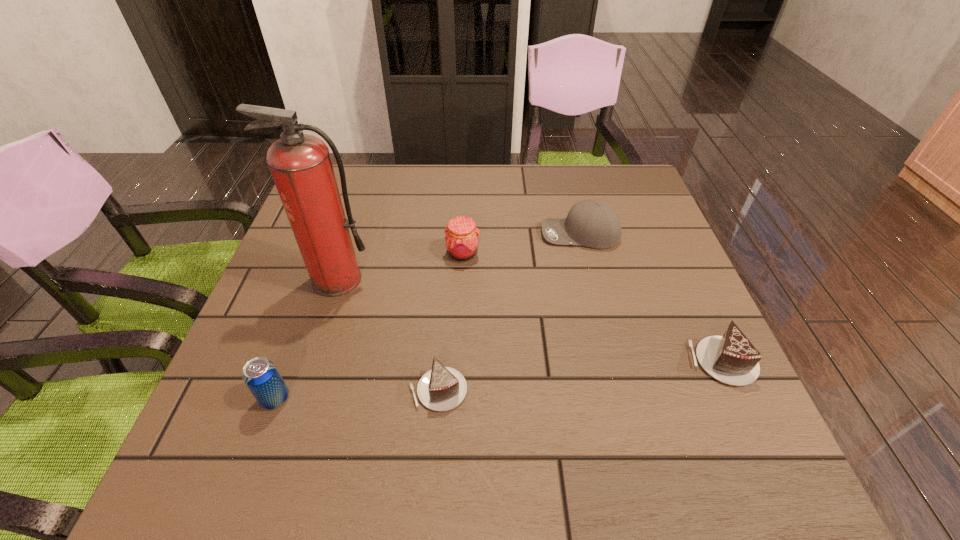
The image size is (960, 540). I want to click on vacant point located between the shortest object and the jam, so tap(450, 322).

Find the location of a particular element. unoccupied area between the left chocolate cake and the fire extinguisher is located at coordinates (388, 335).

Where is `empty space between the fifth object from left to right and the second shortest object`? empty space between the fifth object from left to right and the second shortest object is located at coordinates (651, 298).

I want to click on free space that is in between the tallest object and the beer can, so click(306, 339).

This screenshot has width=960, height=540. What are the coordinates of `vacant region between the beer can and the jam` in the screenshot? It's located at (369, 326).

You are a GUI agent. You are given a task and a screenshot of the screen. Output one action in this format:
    pyautogui.click(x=<x>, y=<y>)
    Task: Click on the free space between the jam and the beer can
    Image resolution: width=960 pixels, height=540 pixels.
    Given the screenshot: What is the action you would take?
    pyautogui.click(x=369, y=326)

Identify the location of object that stands as the second closest to the jam. The image size is (960, 540). (300, 164).

Find the location of a particular element. object that is the fourth closest one to the beer can is located at coordinates (590, 223).

This screenshot has width=960, height=540. In order to click on vacant region that satisfies the following two spatial constraints: 1. on the front brim of the fifth object from left to right; 2. on the front side of the shortest object in this screenshot , I will do `click(618, 390)`.

Where is `vacant space that satisfies the following two spatial constraints: 1. on the back side of the fifth tallest object; 2. on the left side of the beer can`? The width and height of the screenshot is (960, 540). vacant space that satisfies the following two spatial constraints: 1. on the back side of the fifth tallest object; 2. on the left side of the beer can is located at coordinates (289, 362).